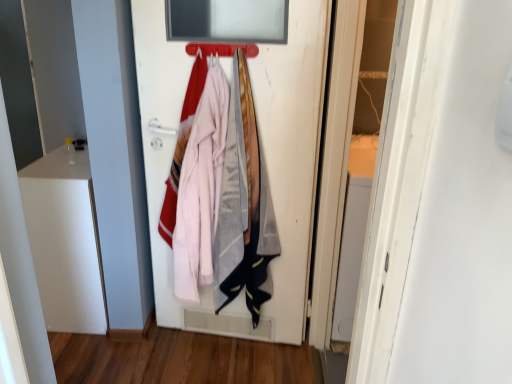
Question: From the image's perspective, is metallic silver hanger at upper center beneath white matte door at center?

Choices:
 (A) no
 (B) yes

Answer: (A)

Question: Is metallic silver hanger at upper center far away from white matte door at center?

Choices:
 (A) yes
 (B) no

Answer: (B)

Question: Does metallic silver hanger at upper center come in front of white matte door at center?

Choices:
 (A) no
 (B) yes

Answer: (A)

Question: Is metallic silver hanger at upper center next to white matte door at center and touching it?

Choices:
 (A) no
 (B) yes

Answer: (A)

Question: From a real-world perspective, is metallic silver hanger at upper center located beneath white matte door at center?

Choices:
 (A) no
 (B) yes

Answer: (A)

Question: Could you tell me if metallic silver hanger at upper center is turned towards white matte door at center?

Choices:
 (A) yes
 (B) no

Answer: (B)

Question: From a real-world perspective, does white matte door at center stand above metallic silver hanger at upper center?

Choices:
 (A) yes
 (B) no

Answer: (B)

Question: Is white matte door at center bigger than metallic silver hanger at upper center?

Choices:
 (A) yes
 (B) no

Answer: (A)

Question: Does white matte door at center contain metallic silver hanger at upper center?

Choices:
 (A) yes
 (B) no

Answer: (B)

Question: Considering the relative positions of white matte door at center and metallic silver hanger at upper center in the image provided, is white matte door at center to the left of metallic silver hanger at upper center from the viewer's perspective?

Choices:
 (A) yes
 (B) no

Answer: (B)

Question: Does white matte door at center appear on the right side of metallic silver hanger at upper center?

Choices:
 (A) yes
 (B) no

Answer: (A)

Question: Is white matte door at center aimed at metallic silver hanger at upper center?

Choices:
 (A) yes
 (B) no

Answer: (A)

Question: From the image's perspective, is white matte door at center positioned above or below metallic silver hanger at upper center?

Choices:
 (A) above
 (B) below

Answer: (B)